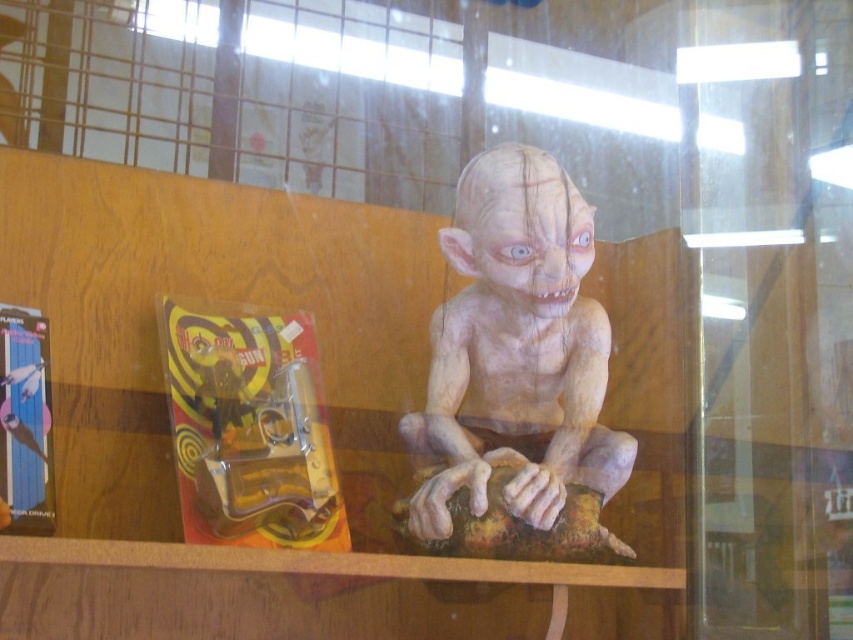
Question: Does pale flesh-like zombie at center have a smaller size compared to metallic silver gun at lower left?

Choices:
 (A) yes
 (B) no

Answer: (B)

Question: In this image, where is pale flesh-like zombie at center located relative to metallic silver gun at lower left?

Choices:
 (A) above
 (B) below

Answer: (A)

Question: Which object is closer to the camera taking this photo?

Choices:
 (A) pale flesh-like zombie at center
 (B) metallic silver gun at lower left

Answer: (B)

Question: Is the position of pale flesh-like zombie at center less distant than that of metallic silver gun at lower left?

Choices:
 (A) yes
 (B) no

Answer: (B)

Question: Which point appears closest to the camera in this image?

Choices:
 (A) (592, 436)
 (B) (300, 464)

Answer: (B)